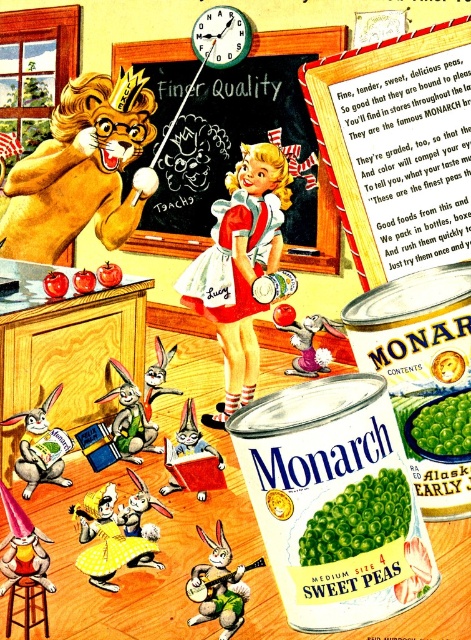
Is point (38, 170) positioned after point (245, 600)?

That is True.

Does point (25, 195) lie in front of point (209, 611)?

No.

Who is more distant from viewer, (103, 144) or (200, 564)?

The point (103, 144) is behind.

At what (x,y) coordinates should I click in order to perform the action: click on golden fur lion at upper left. Please return your answer as a coordinate pair (x, y). Image resolution: width=471 pixels, height=640 pixels. Looking at the image, I should click on (81, 170).

Is green felt rabbit at lower center above brushed metal stool at lower left?

Yes, green felt rabbit at lower center is above brushed metal stool at lower left.

From the picture: Who is more forward, [228,563] or [35,624]?

Point [35,624]

Where is `green felt rabbit at lower center`? green felt rabbit at lower center is located at coordinates (219, 586).

Measure the distance between green matte sweet peas at center and green matte peas at center.

The distance of green matte sweet peas at center from green matte peas at center is 4.57 inches.

Who is more forward, (x=306, y=545) or (x=440, y=417)?

Positioned in front is point (x=306, y=545).

Which is behind, point (330, 554) or point (457, 426)?

The point (457, 426) is more distant.

Locate an element on the screen. Image resolution: width=471 pixels, height=640 pixels. green matte sweet peas at center is located at coordinates (357, 518).